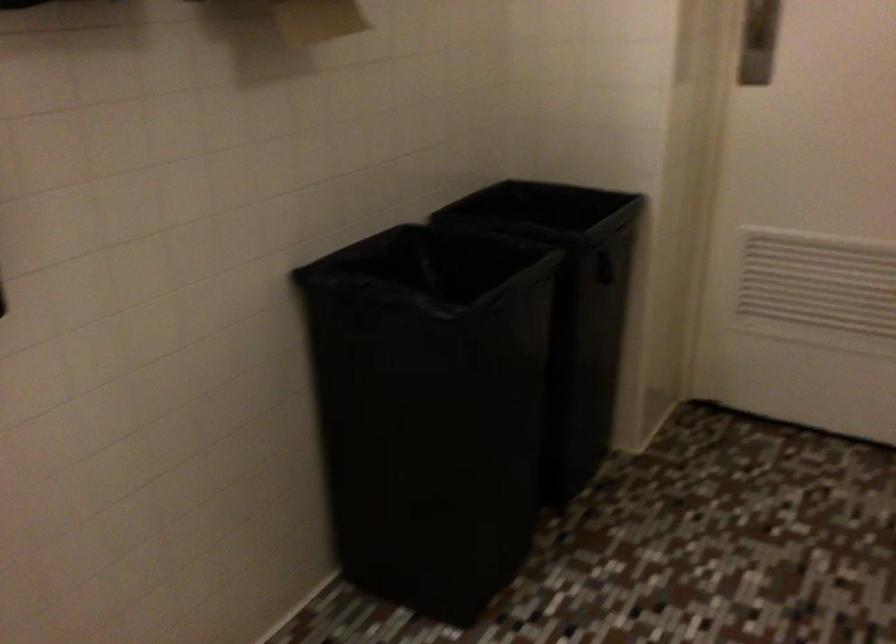
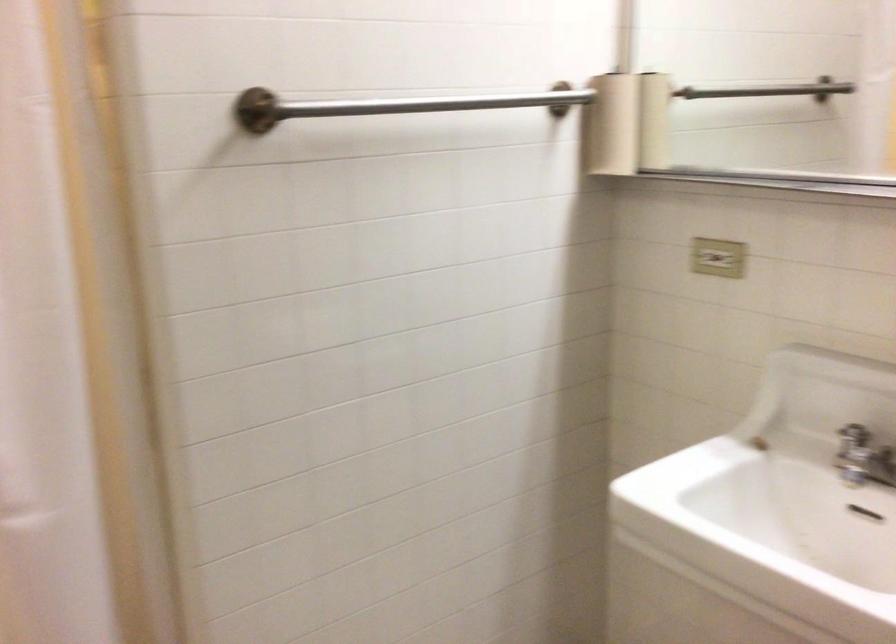
How did the camera likely rotate?

The rotation direction of the camera is left-down.